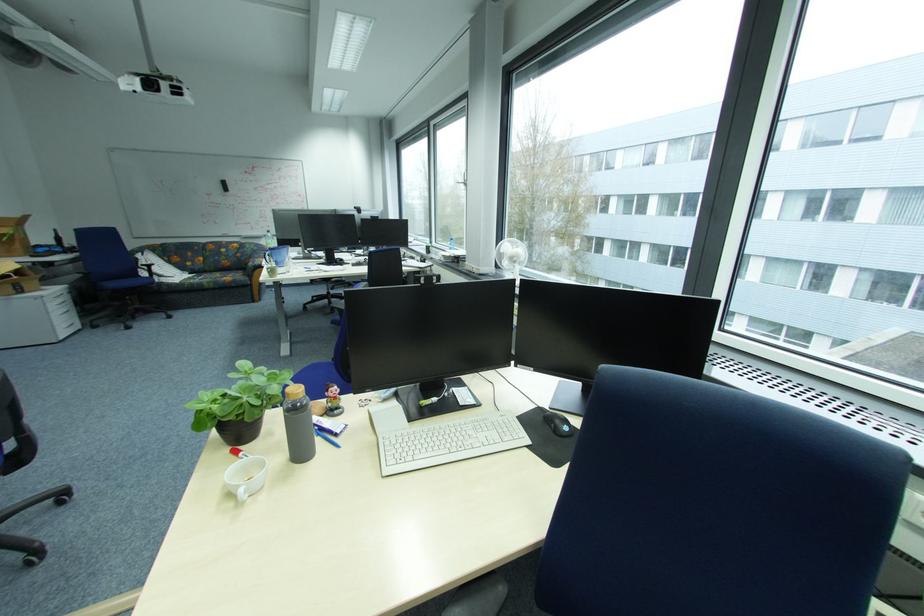
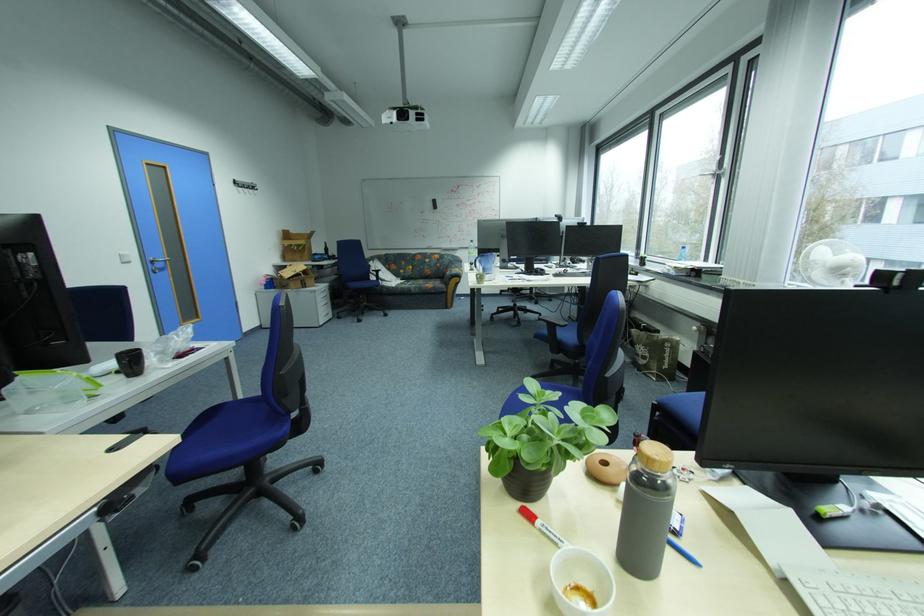
What movement of the cameraman would produce the second image?

The movement direction of the cameraman is left, forward.